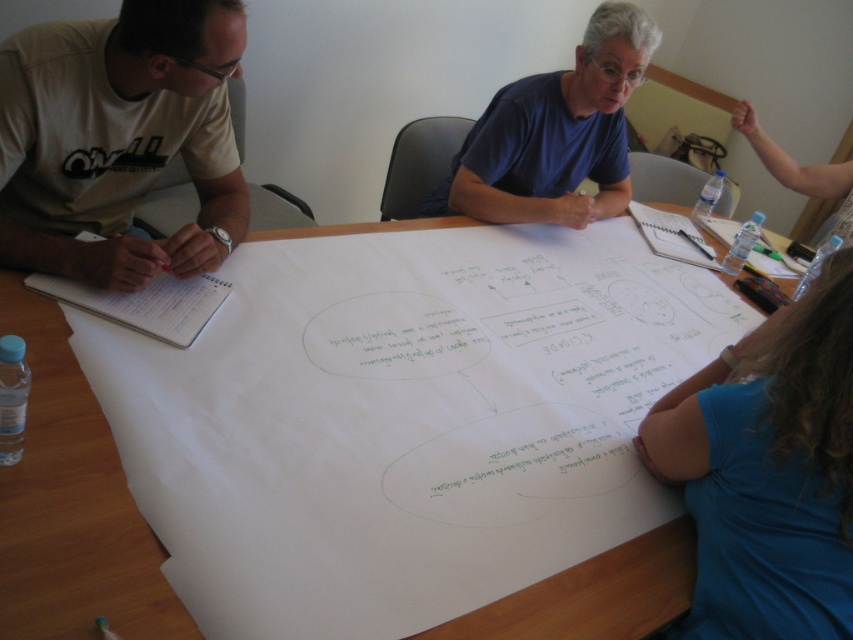
Question: Which point is closer to the camera?

Choices:
 (A) (793, 465)
 (B) (231, 16)
 (C) (461, 188)
 (D) (50, 384)

Answer: (A)

Question: Estimate the real-world distances between objects in this image. Which object is closer to the blue fabric shirt at lower right?

Choices:
 (A) white t-shirt at left
 (B) blue cotton shirt at upper center
 (C) white paper at center

Answer: (C)

Question: Can you confirm if blue fabric shirt at lower right is positioned below white paper at left?

Choices:
 (A) yes
 (B) no

Answer: (A)

Question: Can you confirm if blue cotton shirt at upper center is bigger than white paper at left?

Choices:
 (A) yes
 (B) no

Answer: (A)

Question: Is white paper at center above white t-shirt at left?

Choices:
 (A) yes
 (B) no

Answer: (B)

Question: Estimate the real-world distances between objects in this image. Which object is closer to the white t-shirt at left?

Choices:
 (A) blue cotton shirt at upper center
 (B) white paper at left
 (C) white paper at center
 (D) blue fabric shirt at lower right

Answer: (B)